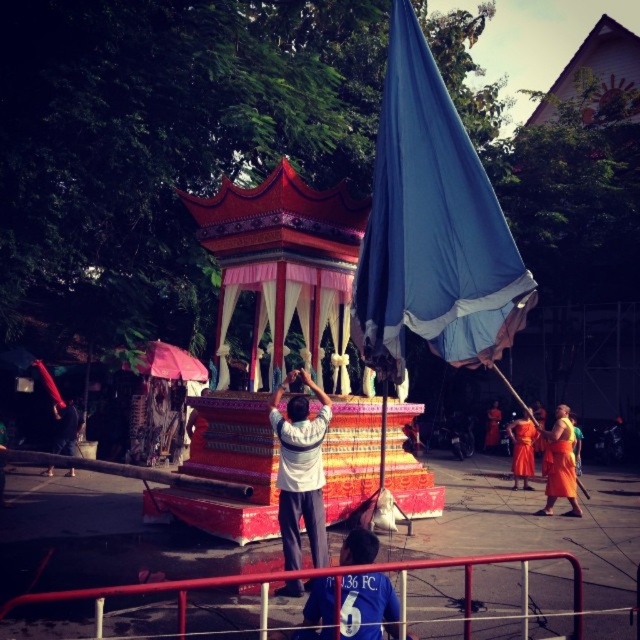
Can you confirm if blue fabric flag at center is taller than white matte shirt at center?

Correct, blue fabric flag at center is much taller as white matte shirt at center.

Is blue fabric flag at center further to camera compared to white matte shirt at center?

That is True.

Is point (433, 109) positioned in front of point (308, 449)?

That is False.

The image size is (640, 640). Identify the location of blue fabric flag at center. (433, 225).

Is white matte shirt at center in front of orange cloth at right?

Yes, it is in front of orange cloth at right.

Is white matte shirt at center wider than orange cloth at right?

Incorrect, white matte shirt at center's width does not surpass orange cloth at right's.

Is point (301, 593) in front of point (554, 442)?

Yes, point (301, 593) is in front of point (554, 442).

Image resolution: width=640 pixels, height=640 pixels. I want to click on white matte shirt at center, so click(300, 470).

Can you confirm if polychrome painted wooden gazebo at center is positioned to the right of orange cloth at right?

No, polychrome painted wooden gazebo at center is not to the right of orange cloth at right.

Locate an element on the screen. polychrome painted wooden gazebo at center is located at coordinates (276, 346).